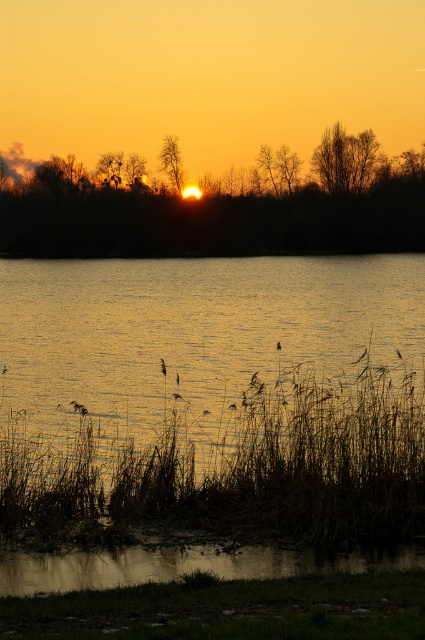
You are a photographer aiming to capture the sunset reflection on the water. You notice a brown grass at lower center and a brown feathered bird at center in the scene. Which object is positioned to the right side of the other?

The brown grass at lower center is to the right of brown feathered bird at center, so the brown grass at lower center is positioned to the right of the brown feathered bird at center.

You are standing at the point closest to the water in the sunset scene. Which point, point (36, 524) or point (280, 344), is closer to you?

Point (36, 524) is closer to you because it is in front of point (280, 344).